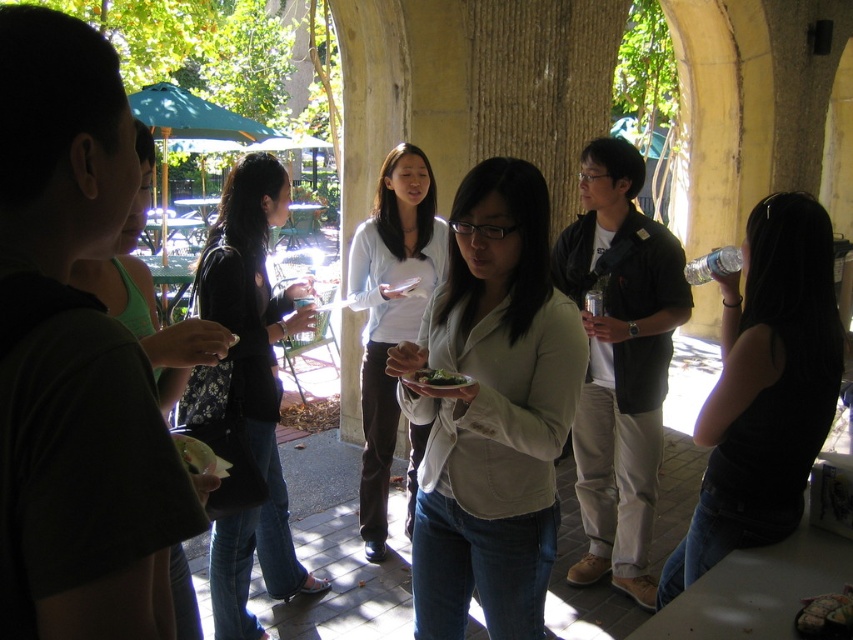
Does light beige shirt at center have a lesser width compared to matte black shirt at left?

Yes, light beige shirt at center is thinner than matte black shirt at left.

Does point (494, 531) come closer to viewer compared to point (138, 195)?

No, it is not.

Is point (485, 444) positioned behind point (123, 291)?

Yes, it is behind point (123, 291).

The image size is (853, 640). In order to click on light beige shirt at center in this screenshot , I will do `click(491, 410)`.

Is dark blue jeans at center taller than green leafy salad at center?

Yes, dark blue jeans at center is taller than green leafy salad at center.

Does dark blue jeans at center have a lesser height compared to green leafy salad at center?

No.

Is point (225, 289) closer to camera compared to point (445, 385)?

That is False.

Where is `dark blue jeans at center`? Image resolution: width=853 pixels, height=640 pixels. dark blue jeans at center is located at coordinates (248, 388).

Is point (247, 220) positioned behind point (175, 620)?

That is True.

Is point (247, 588) positioned in front of point (142, 342)?

That is False.

Does point (229, 572) lie in front of point (138, 288)?

No.

At what (x,y) coordinates should I click in order to perform the action: click on dark blue jeans at center. Please return your answer as a coordinate pair (x, y). Image resolution: width=853 pixels, height=640 pixels. Looking at the image, I should click on (248, 388).